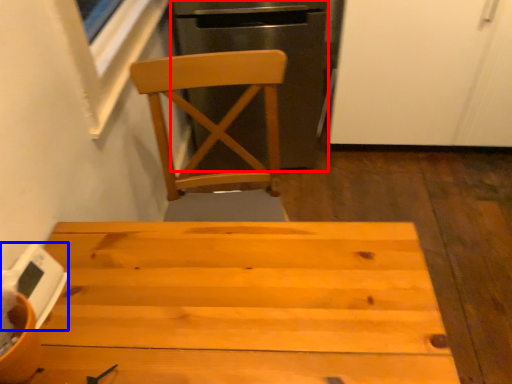
Question: Among these objects, which one is nearest to the camera, leftover (highlighted by a red box) or appliance (highlighted by a blue box)?

Choices:
 (A) leftover
 (B) appliance

Answer: (B)